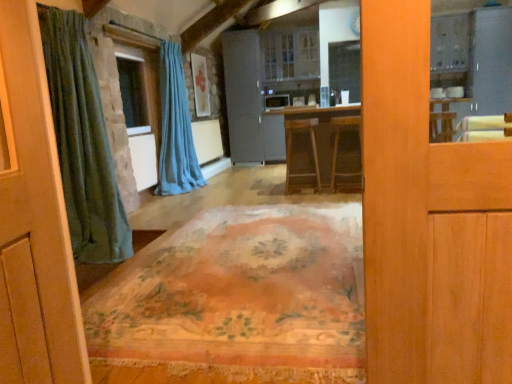
You are a GUI agent. You are given a task and a screenshot of the screen. Output one action in this format:
    pyautogui.click(x=<x>, y=<y>)
    Task: Click on the unoccupied region to the right of blue fabric curtain at center
    This screenshot has height=384, width=512.
    Given the screenshot: What is the action you would take?
    pyautogui.click(x=223, y=186)